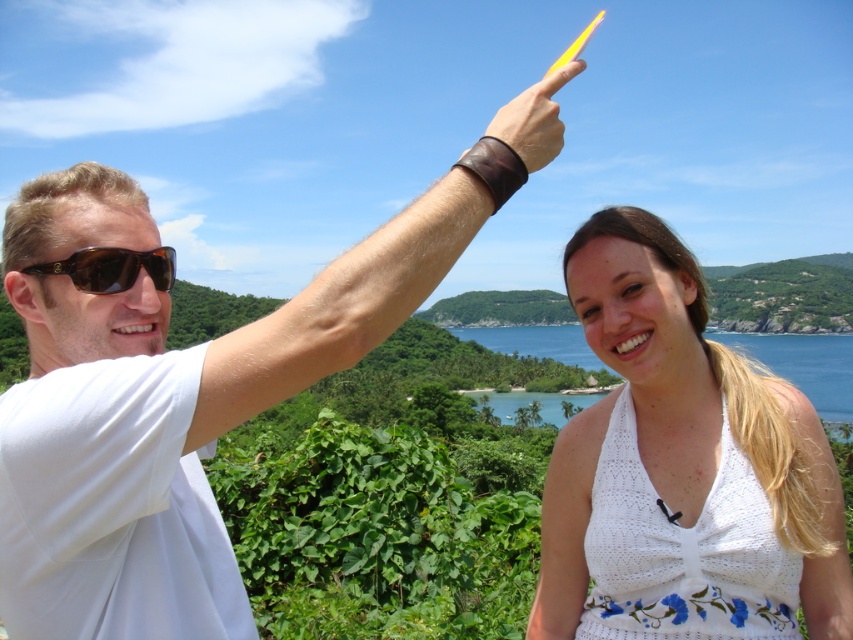
Who is lower down, matte white shirt at upper left or leather wristband at upper center?

matte white shirt at upper left

Is matte white shirt at upper left below leather wristband at upper center?

Indeed, matte white shirt at upper left is positioned under leather wristband at upper center.

What do you see at coordinates (172, 401) in the screenshot? Image resolution: width=853 pixels, height=640 pixels. I see `matte white shirt at upper left` at bounding box center [172, 401].

Find the location of a particular element. This screenshot has height=640, width=853. matte white shirt at upper left is located at coordinates (172, 401).

Is white crochet dress at center below brown matte sunglasses at upper left?

Correct, white crochet dress at center is located below brown matte sunglasses at upper left.

Who is more distant from viewer, (x=602, y=260) or (x=173, y=257)?

Positioned behind is point (x=602, y=260).

At what (x,y) coordinates should I click in order to perform the action: click on white crochet dress at center. Please return your answer as a coordinate pair (x, y). This screenshot has width=853, height=640. Looking at the image, I should click on pyautogui.click(x=683, y=440).

Is point (131, 474) closer to camera compared to point (624, 369)?

Yes, point (131, 474) is closer to viewer.

Based on the photo, does matte white shirt at upper left have a larger size compared to white crochet dress at center?

Correct, matte white shirt at upper left is larger in size than white crochet dress at center.

Identify the location of matte white shirt at upper left. This screenshot has height=640, width=853. (172, 401).